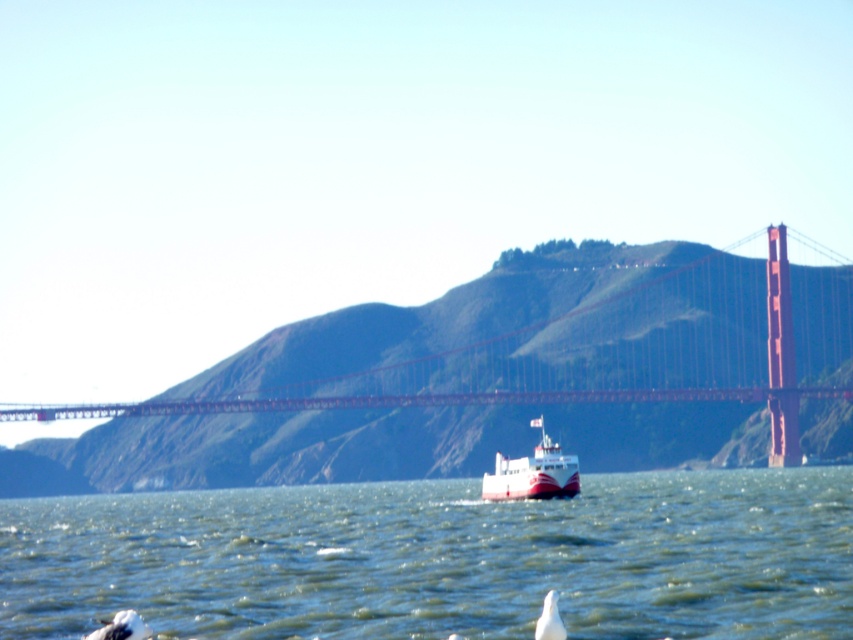
Is white matte bird at lower left below white matte bird at lower center?

→ Correct, white matte bird at lower left is located below white matte bird at lower center.

How much distance is there between white matte bird at lower left and white matte bird at lower center?

11.21 meters

Is point (102, 632) behind point (546, 596)?

No, it is not.

This screenshot has height=640, width=853. Identify the location of white matte bird at lower left. (120, 627).

Is greenish water at center positioned at the back of white matte bird at lower center?

Yes, it is.

Can you confirm if greenish water at center is wider than white matte bird at lower center?

Yes, greenish water at center is wider than white matte bird at lower center.

Who is more distant from viewer, (x=717, y=481) or (x=538, y=636)?

The point (x=717, y=481) is more distant.

The height and width of the screenshot is (640, 853). In order to click on greenish water at center in this screenshot , I will do `click(440, 560)`.

Does white glossy ferry at center have a lesser width compared to white matte bird at lower center?

No.

What do you see at coordinates (532, 472) in the screenshot? I see `white glossy ferry at center` at bounding box center [532, 472].

Identify the location of white glossy ferry at center. (532, 472).